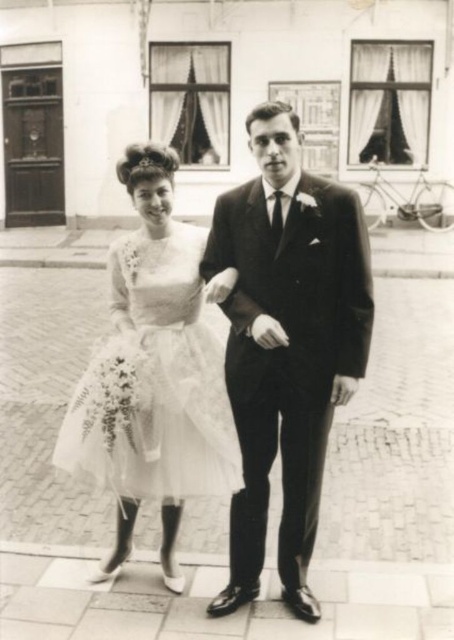
Is smooth black suit at center positioned behind matte white tulle dress at center?

No, it is not.

Can you confirm if smooth black suit at center is positioned to the right of matte white tulle dress at center?

Yes, smooth black suit at center is to the right of matte white tulle dress at center.

Identify the location of smooth black suit at center. The image size is (454, 640). [x=286, y=344].